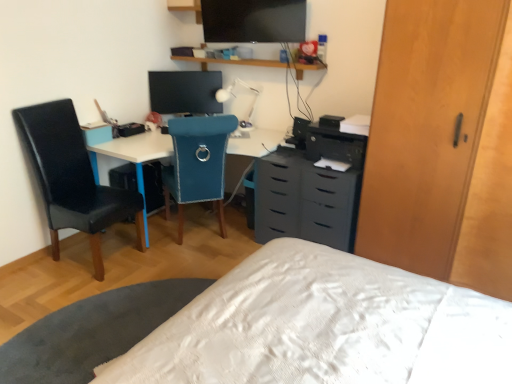
This screenshot has height=384, width=512. I want to click on free point in front of black leather chair at left, placed as the second chair when sorted from right to left, so click(x=68, y=299).